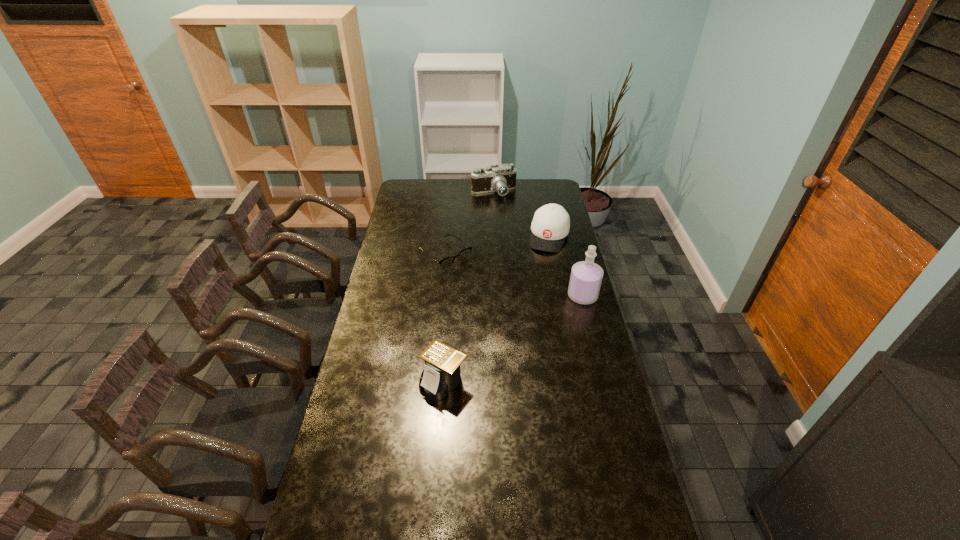
You are a GUI agent. You are given a task and a screenshot of the screen. Output one action in this format:
    pyautogui.click(x=<x>, y=<y>)
    Task: Click on the vacant space on the desktop that is between the nearest object and the second nearest object and is positioned on the face of the shortest object
    The image size is (960, 540).
    Given the screenshot: What is the action you would take?
    pyautogui.click(x=531, y=327)

Identify the location of free space on the desktop that is between the nearest object and the perfume and is positioned on the front-facing side of the baseball cap. (519, 334).

You are a GUI agent. You are given a task and a screenshot of the screen. Output one action in this format:
    pyautogui.click(x=<x>, y=<y>)
    Task: Click on the vacant space on the desktop that is between the nearest object and the perfume and is positioned at the lens of the camera
    This screenshot has height=540, width=960.
    Given the screenshot: What is the action you would take?
    pyautogui.click(x=528, y=329)